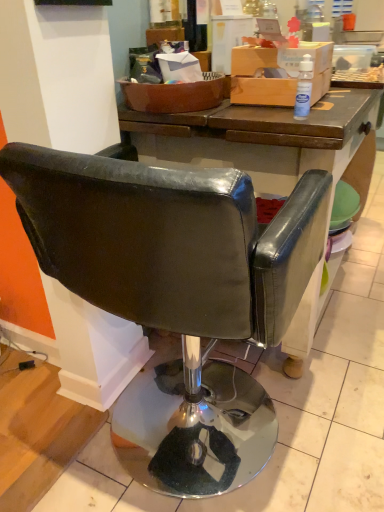
Question: From a real-world perspective, is transparent plastic bottle at upper right positioned above or below leather-like black chair at center?

Choices:
 (A) below
 (B) above

Answer: (B)

Question: Is point pyautogui.click(x=294, y=106) positioned closer to the camera than point pyautogui.click(x=51, y=233)?

Choices:
 (A) closer
 (B) farther

Answer: (B)

Question: In terms of width, does transparent plastic bottle at upper right look wider or thinner when compared to leather-like black chair at center?

Choices:
 (A) thin
 (B) wide

Answer: (A)

Question: From the image's perspective, is leather-like black chair at center located above or below transparent plastic bottle at upper right?

Choices:
 (A) below
 (B) above

Answer: (A)

Question: Is leather-like black chair at center situated inside transparent plastic bottle at upper right or outside?

Choices:
 (A) outside
 (B) inside

Answer: (A)

Question: Does point (258, 464) appear closer or farther from the camera than point (302, 117)?

Choices:
 (A) farther
 (B) closer

Answer: (A)

Question: Is leather-like black chair at center to the left or to the right of transparent plastic bottle at upper right in the image?

Choices:
 (A) left
 (B) right

Answer: (A)